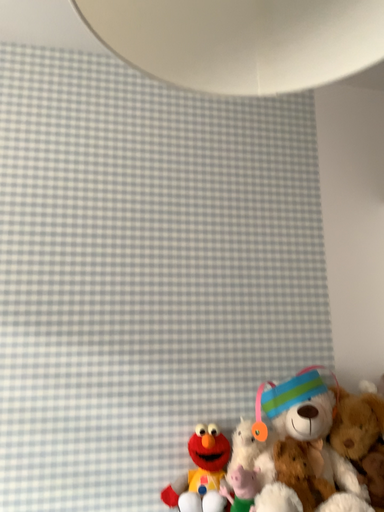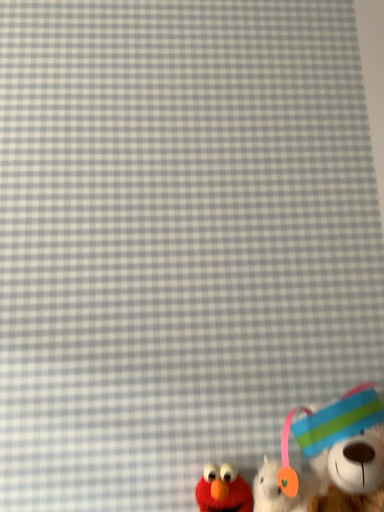
Question: Which way did the camera rotate in the video?

Choices:
 (A) rotated left
 (B) rotated right

Answer: (A)